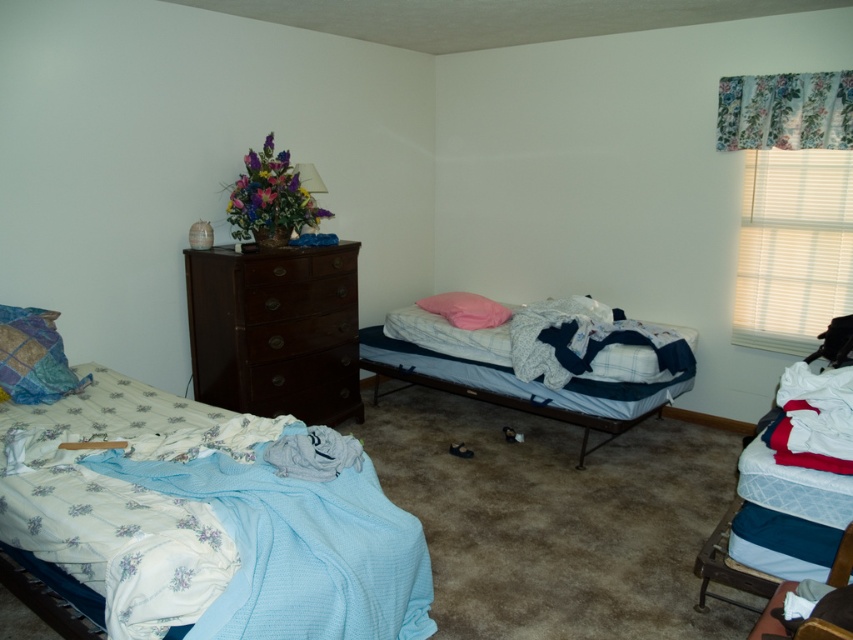
Is point (212, 374) behind point (480, 314)?

No.

Does point (230, 344) come in front of point (440, 308)?

Yes, it is.

This screenshot has height=640, width=853. I want to click on dark wood dresser at center, so click(273, 332).

Can you confirm if floral-patterned fabric bed at center-left is positioned to the right of pink fabric pillow at center?

In fact, floral-patterned fabric bed at center-left is to the left of pink fabric pillow at center.

Is point (200, 595) farther from viewer compared to point (469, 312)?

No, (200, 595) is closer to viewer.

The width and height of the screenshot is (853, 640). Find the location of `floral-patterned fabric bed at center-left`. floral-patterned fabric bed at center-left is located at coordinates (206, 522).

Between blue fabric bed at center and wooden chair at lower right, which one has less height?

Standing shorter between the two is wooden chair at lower right.

What do you see at coordinates (532, 364) in the screenshot? I see `blue fabric bed at center` at bounding box center [532, 364].

Does point (361, 355) come farther from viewer compared to point (831, 625)?

That is True.

The height and width of the screenshot is (640, 853). In order to click on blue fabric bed at center in this screenshot , I will do `click(532, 364)`.